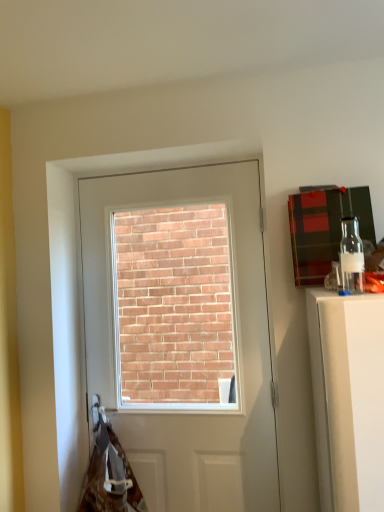
Describe the element at coordinates (234, 348) in the screenshot. I see `white glossy door at center` at that location.

This screenshot has height=512, width=384. In order to click on clear glass bottle at upper right in this screenshot , I will do `click(351, 257)`.

Identify the location of brown fabric at lower left. (109, 475).

Is clear glass bottle at upper right turned away from brown fabric at lower left?

No, clear glass bottle at upper right is not facing the opposite direction of brown fabric at lower left.

From the image's perspective, is clear glass bottle at upper right under brown fabric at lower left?

Incorrect, from the image's perspective, clear glass bottle at upper right is higher than brown fabric at lower left.

Who is smaller, clear glass bottle at upper right or brown fabric at lower left?

Smaller between the two is clear glass bottle at upper right.

How different are the orientations of clear glass bottle at upper right and brown fabric at lower left in degrees?

0.628 degrees separate the facing orientations of clear glass bottle at upper right and brown fabric at lower left.

How far apart are brown fabric at lower left and white glossy door at center?

brown fabric at lower left and white glossy door at center are 14.30 inches apart.

Is brown fabric at lower left oriented away from white glossy door at center?

Absolutely, brown fabric at lower left is directed away from white glossy door at center.

In the scene shown: Can you confirm if brown fabric at lower left is thinner than white glossy door at center?

No, brown fabric at lower left is not thinner than white glossy door at center.

Could you tell me if white glossy door at center is turned towards clear glass bottle at upper right?

No, white glossy door at center is not oriented towards clear glass bottle at upper right.

In the scene shown: Is white glossy door at center wider or thinner than clear glass bottle at upper right?

Clearly, white glossy door at center has more width compared to clear glass bottle at upper right.

Can you confirm if white glossy door at center is bigger than clear glass bottle at upper right?

Yes, white glossy door at center is bigger than clear glass bottle at upper right.

Considering the sizes of objects white glossy door at center and clear glass bottle at upper right in the image provided, who is shorter, white glossy door at center or clear glass bottle at upper right?

clear glass bottle at upper right is shorter.

Is there a large distance between clear glass bottle at upper right and white glossy door at center?

Yes, clear glass bottle at upper right and white glossy door at center are quite far apart.

Considering the sizes of objects clear glass bottle at upper right and white glossy door at center in the image provided, who is smaller, clear glass bottle at upper right or white glossy door at center?

clear glass bottle at upper right is smaller.

Could you tell me if clear glass bottle at upper right is turned towards white glossy door at center?

No, clear glass bottle at upper right is not turned towards white glossy door at center.

Based on the photo, considering the sizes of objects clear glass bottle at upper right and white glossy door at center in the image provided, who is thinner, clear glass bottle at upper right or white glossy door at center?

Thinner between the two is clear glass bottle at upper right.

Considering the positions of objects brown fabric at lower left and clear glass bottle at upper right in the image provided, who is more to the right, brown fabric at lower left or clear glass bottle at upper right?

Positioned to the right is clear glass bottle at upper right.

Which object is more forward, brown fabric at lower left or clear glass bottle at upper right?

clear glass bottle at upper right is in front.

Where is `material behind the clear glass bottle at upper right`? material behind the clear glass bottle at upper right is located at coordinates (109, 475).

Are brown fabric at lower left and clear glass bottle at upper right beside each other?

No, brown fabric at lower left is not next to clear glass bottle at upper right.

In the image, is white glossy door at center positioned in front of or behind brown fabric at lower left?

Visually, white glossy door at center is located behind brown fabric at lower left.

Can you tell me how much white glossy door at center and brown fabric at lower left differ in facing direction?

The angular difference between white glossy door at center and brown fabric at lower left is 0.183 degrees.

From the image's perspective, is white glossy door at center above or below brown fabric at lower left?

Based on their image positions, white glossy door at center is located above brown fabric at lower left.

From a real-world perspective, between white glossy door at center and brown fabric at lower left, who is vertically higher?

white glossy door at center, from a real-world perspective.

Identify the location of material that is behind the clear glass bottle at upper right. The width and height of the screenshot is (384, 512). (109, 475).

You are a GUI agent. You are given a task and a screenshot of the screen. Output one action in this format:
    pyautogui.click(x=<x>, y=<y>)
    Task: Click on the material on the left of white glossy door at center
    
    Given the screenshot: What is the action you would take?
    pyautogui.click(x=109, y=475)

Based on their spatial positions, is white glossy door at center or clear glass bottle at upper right further from brown fabric at lower left?

Based on the image, clear glass bottle at upper right appears to be further to brown fabric at lower left.

Looking at this image, based on their spatial positions, is brown fabric at lower left or white glossy door at center closer to clear glass bottle at upper right?

white glossy door at center.

Looking at the image, which one is located further to brown fabric at lower left, clear glass bottle at upper right or white glossy door at center?

Based on the image, clear glass bottle at upper right appears to be further to brown fabric at lower left.

In the scene shown: Estimate the real-world distances between objects in this image. Which object is further from white glossy door at center, brown fabric at lower left or clear glass bottle at upper right?

clear glass bottle at upper right is positioned further to the anchor white glossy door at center.

Based on the photo, from the image, which object appears to be farther from white glossy door at center, clear glass bottle at upper right or brown fabric at lower left?

The object further to white glossy door at center is clear glass bottle at upper right.

Based on the photo, looking at the image, which one is located closer to clear glass bottle at upper right, white glossy door at center or brown fabric at lower left?

white glossy door at center is closer to clear glass bottle at upper right.

You are a GUI agent. You are given a task and a screenshot of the screen. Output one action in this format:
    pyautogui.click(x=<x>, y=<y>)
    Task: Click on the door between clear glass bottle at upper right and brown fabric at lower left in the vertical direction
    
    Given the screenshot: What is the action you would take?
    [x=234, y=348]